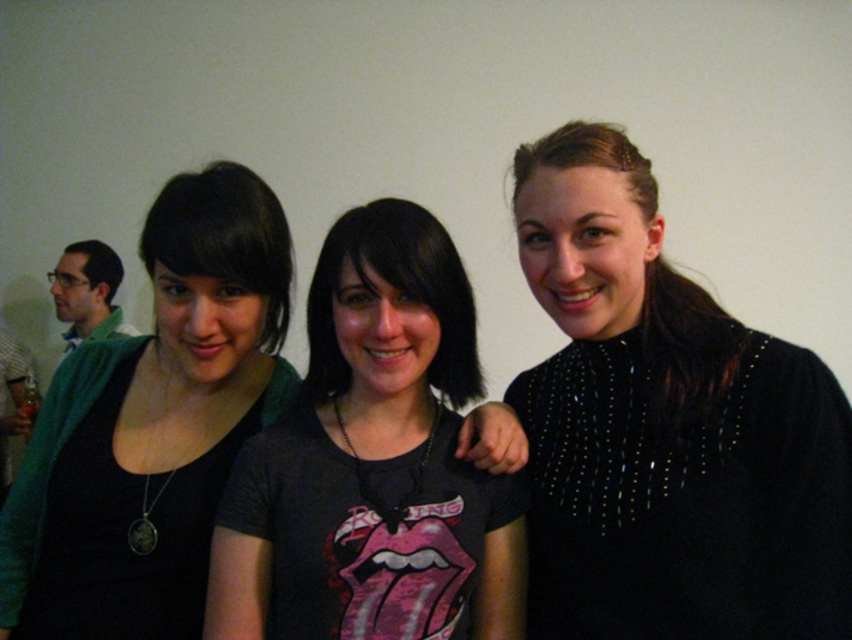
Who is positioned more to the left, black sequined top at right or green fabric shirt at left?

green fabric shirt at left

Is black sequined top at right taller than green fabric shirt at left?

Yes.

Is point (630, 230) positioned behind point (62, 348)?

No, (630, 230) is closer to viewer.

Where is `black sequined top at right`? This screenshot has height=640, width=852. black sequined top at right is located at coordinates (665, 429).

Does black sequined top at right have a lesser height compared to black t-shirt with graphic at center?

In fact, black sequined top at right may be taller than black t-shirt with graphic at center.

Does black sequined top at right lie behind black t-shirt with graphic at center?

That is False.

This screenshot has width=852, height=640. What do you see at coordinates (665, 429) in the screenshot? I see `black sequined top at right` at bounding box center [665, 429].

This screenshot has width=852, height=640. What are the coordinates of `black sequined top at right` in the screenshot? It's located at (665, 429).

Does black t-shirt with graphic at center have a greater width compared to matte black shirt at center?

In fact, black t-shirt with graphic at center might be narrower than matte black shirt at center.

Can you confirm if black t-shirt with graphic at center is bigger than matte black shirt at center?

Actually, black t-shirt with graphic at center might be smaller than matte black shirt at center.

Is point (419, 374) positioned in front of point (142, 472)?

Yes, point (419, 374) is in front of point (142, 472).

Where is `black t-shirt with graphic at center`? black t-shirt with graphic at center is located at coordinates (371, 461).